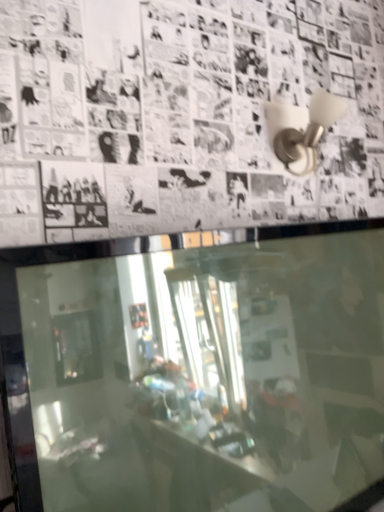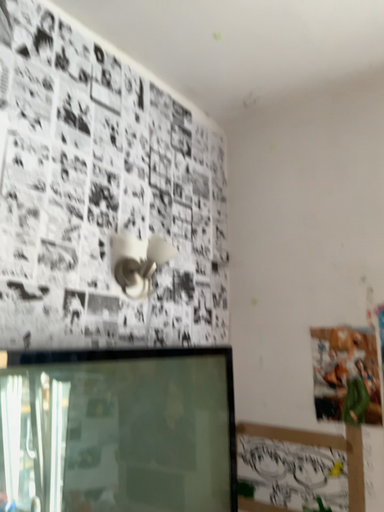
Question: Which way did the camera rotate in the video?

Choices:
 (A) rotated right
 (B) rotated left

Answer: (A)